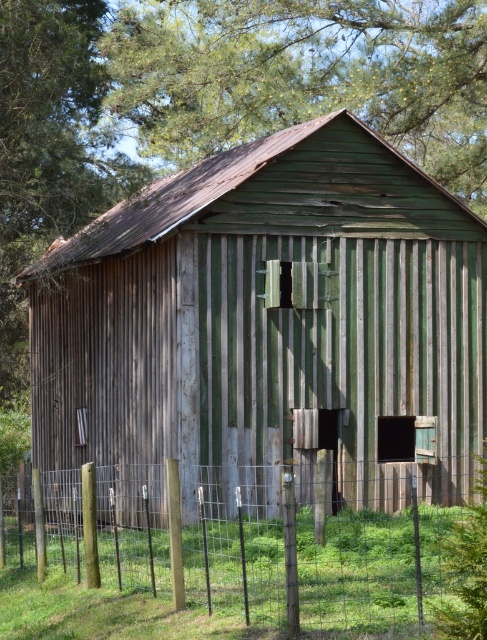
Is green corrugated metal barn at center positioned behind metal wire fence at lower center?

Yes.

Which of these two, green corrugated metal barn at center or metal wire fence at lower center, stands shorter?

metal wire fence at lower center

Image resolution: width=487 pixels, height=640 pixels. In order to click on green corrugated metal barn at center in this screenshot , I will do [269, 323].